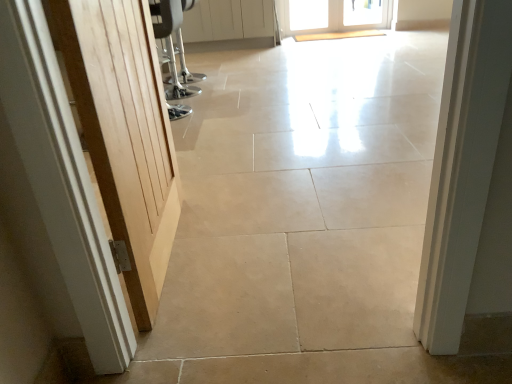
Question: In terms of size, does white glossy door at upper center, which is the first door in left-to-right order, appear bigger or smaller than light wood door at left, arranged as the first door when viewed from the front?

Choices:
 (A) small
 (B) big

Answer: (B)

Question: From the image's perspective, is white glossy door at upper center, the second door ordered from the bottom, above or below light wood door at left, arranged as the first door when viewed from the front?

Choices:
 (A) above
 (B) below

Answer: (A)

Question: Estimate the real-world distances between objects in this image. Which object is farther from the white glass door at upper center, which is the third door from bottom to top?

Choices:
 (A) light wood door at left, arranged as the third door when viewed from the top
 (B) white glossy door at upper center, which is the first door in left-to-right order

Answer: (A)

Question: Estimate the real-world distances between objects in this image. Which object is farther from the light wood door at left, acting as the 2th door starting from the left?

Choices:
 (A) white glass door at upper center, which appears as the first door when viewed from the back
 (B) white glossy door at upper center, the third door in the right-to-left sequence

Answer: (A)